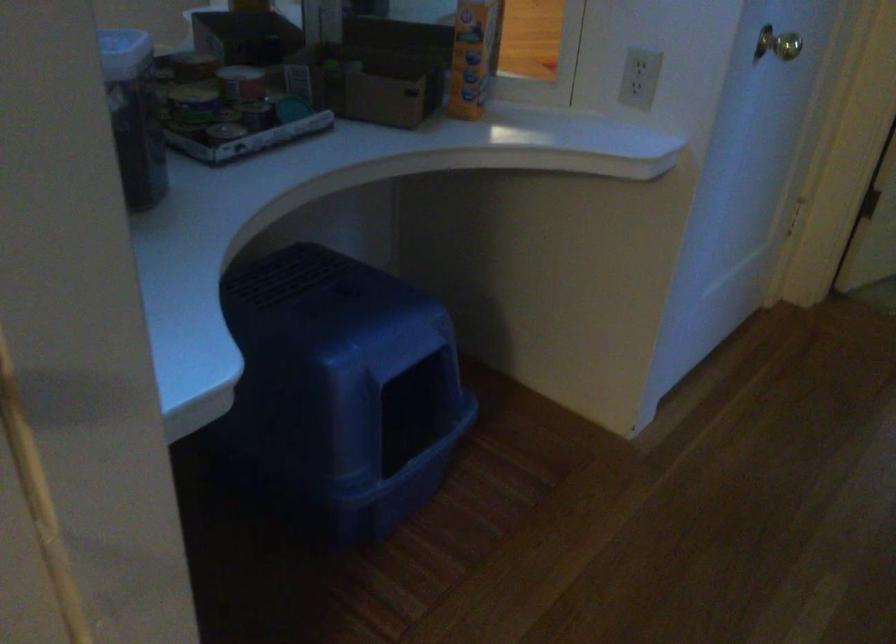
Describe the element at coordinates (124, 53) in the screenshot. I see `the white jar lid` at that location.